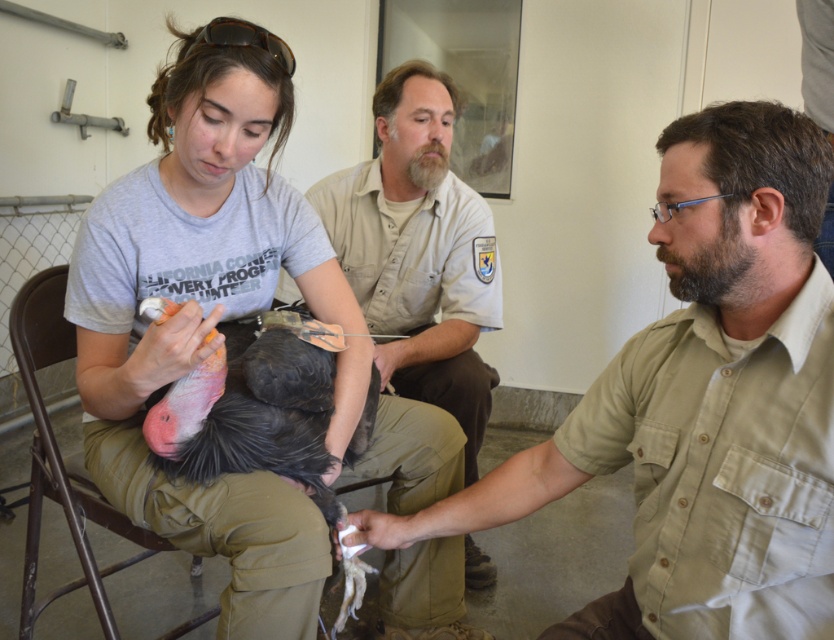
Which is behind, point (284, 112) or point (41, 604)?

The point (41, 604) is more distant.

Does matte gray shirt at center have a greater width compared to metallic brown chair at lower left?

Indeed, matte gray shirt at center has a greater width compared to metallic brown chair at lower left.

Based on the photo, who is more distant from viewer, [137,435] or [99,618]?

The point [99,618] is behind.

Where is `matte gray shirt at center`? The height and width of the screenshot is (640, 834). matte gray shirt at center is located at coordinates (204, 312).

Can you confirm if khaki uniform shirt at center is smaller than metallic brown chair at lower left?

No.

Is point (455, 330) positioned after point (23, 355)?

Yes, point (455, 330) is behind point (23, 355).

Describe the element at coordinates (420, 252) in the screenshot. This screenshot has height=640, width=834. I see `khaki uniform shirt at center` at that location.

The image size is (834, 640). In order to click on khaki uniform shirt at center in this screenshot , I will do `click(420, 252)`.

Does matte khaki shirt at center have a larger size compared to khaki uniform shirt at center?

No, matte khaki shirt at center is not bigger than khaki uniform shirt at center.

Who is positioned more to the right, matte khaki shirt at center or khaki uniform shirt at center?

From the viewer's perspective, matte khaki shirt at center appears more on the right side.

Which is behind, point (817, 184) or point (431, 83)?

Positioned behind is point (431, 83).

Locate an element on the screen. The image size is (834, 640). matte khaki shirt at center is located at coordinates (702, 403).